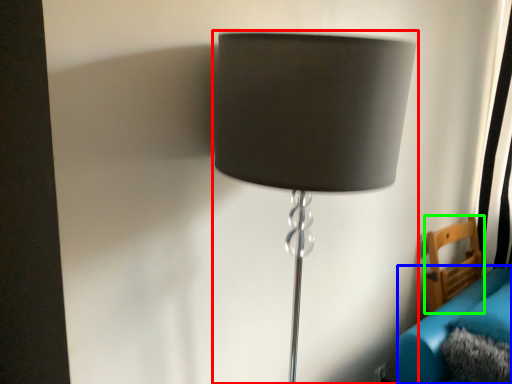
Question: Which object is the farthest from lamp (highlighted by a red box)? Choose among these: couch (highlighted by a blue box) or furniture (highlighted by a green box).

Choices:
 (A) couch
 (B) furniture

Answer: (B)